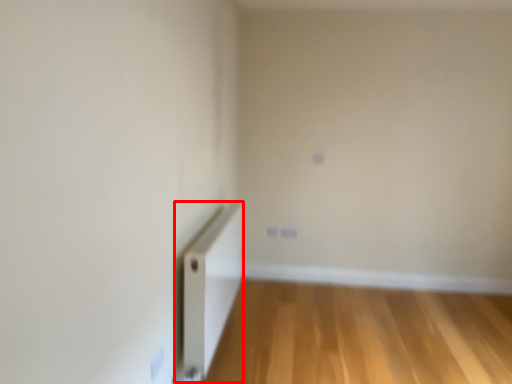
Question: Considering the relative positions of radiator (annotated by the red box) and corridor in the image provided, where is radiator (annotated by the red box) located with respect to the staircase?

Choices:
 (A) right
 (B) left

Answer: (B)